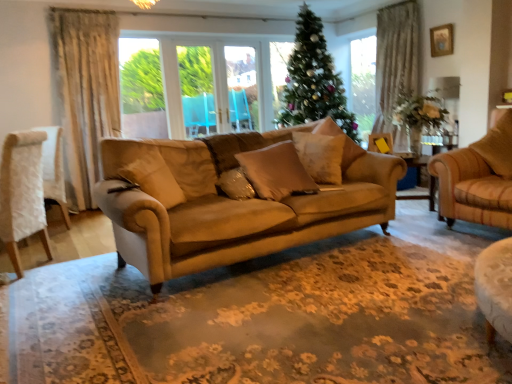
Question: Considering the relative sizes of white fabric chair at left and wooden picture frame at upper right in the image provided, is white fabric chair at left smaller than wooden picture frame at upper right?

Choices:
 (A) yes
 (B) no

Answer: (B)

Question: Is white fabric chair at left wider than wooden picture frame at upper right?

Choices:
 (A) yes
 (B) no

Answer: (A)

Question: From a real-world perspective, is white fabric chair at left located beneath wooden picture frame at upper right?

Choices:
 (A) yes
 (B) no

Answer: (A)

Question: From the image's perspective, would you say white fabric chair at left is shown under wooden picture frame at upper right?

Choices:
 (A) yes
 (B) no

Answer: (A)

Question: Is white fabric chair at left positioned in front of wooden picture frame at upper right?

Choices:
 (A) no
 (B) yes

Answer: (B)

Question: From a real-world perspective, is beige fabric pillow at center, which is the first pillow from left to right, above or below satin gold pillow at center, positioned as the 5th pillow in right-to-left order?

Choices:
 (A) above
 (B) below

Answer: (A)

Question: Does point (173, 205) appear closer or farther from the camera than point (242, 173)?

Choices:
 (A) closer
 (B) farther

Answer: (A)

Question: Looking at their shapes, would you say beige fabric pillow at center, which is the first pillow from left to right, is wider or thinner than satin gold pillow at center, positioned as the 5th pillow in right-to-left order?

Choices:
 (A) wide
 (B) thin

Answer: (B)

Question: In the image, is beige fabric pillow at center, the sixth pillow in the right-to-left sequence, on the left side or the right side of satin gold pillow at center, which appears as the 2th pillow when viewed from the left?

Choices:
 (A) left
 (B) right

Answer: (A)

Question: In terms of height, does wooden picture frame at upper right look taller or shorter compared to white fabric chair at left?

Choices:
 (A) tall
 (B) short

Answer: (B)

Question: From a real-world perspective, relative to white fabric chair at left, is wooden picture frame at upper right vertically above or below?

Choices:
 (A) below
 (B) above

Answer: (B)

Question: Looking at the image, does wooden picture frame at upper right seem bigger or smaller compared to white fabric chair at left?

Choices:
 (A) small
 (B) big

Answer: (A)

Question: Considering the positions of wooden picture frame at upper right and white fabric chair at left in the image, is wooden picture frame at upper right wider or thinner than white fabric chair at left?

Choices:
 (A) thin
 (B) wide

Answer: (A)

Question: Does point (340, 139) appear closer or farther from the camera than point (230, 175)?

Choices:
 (A) farther
 (B) closer

Answer: (A)

Question: Is satin beige pillow at center, the 4th pillow in the left-to-right sequence, wider or thinner than satin gold pillow at center, which appears as the 2th pillow when viewed from the left?

Choices:
 (A) thin
 (B) wide

Answer: (A)